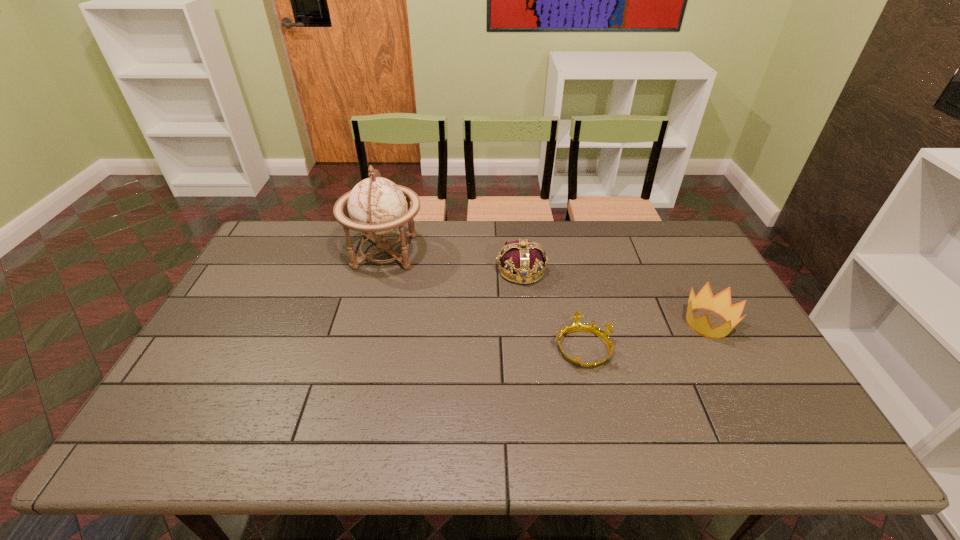
The width and height of the screenshot is (960, 540). I want to click on globe, so click(x=377, y=206).

Locate an element on the screen. The image size is (960, 540). the tallest object is located at coordinates (377, 206).

The image size is (960, 540). Find the location of `the second tallest object`. the second tallest object is located at coordinates (524, 259).

The height and width of the screenshot is (540, 960). I want to click on the tallest crown, so click(524, 259).

At what (x,y) coordinates should I click in order to perform the action: click on the rightmost object. Please return your answer as a coordinate pair (x, y). Looking at the image, I should click on (721, 303).

Image resolution: width=960 pixels, height=540 pixels. I want to click on the second tallest crown, so click(x=721, y=303).

The height and width of the screenshot is (540, 960). Find the location of `the shortest object`. the shortest object is located at coordinates (576, 326).

Locate an element on the screen. vacant space positioned at the front of the tallest object showing Africa is located at coordinates (507, 252).

What are the coordinates of `vacant space located 0.370m on the right of the tallest crown` in the screenshot? It's located at (661, 271).

You are a GUI agent. You are given a task and a screenshot of the screen. Output one action in this format:
    pyautogui.click(x=<x>, y=<y>)
    Task: Click on the vacant space situated on the back of the rightmost crown
    
    Given the screenshot: What is the action you would take?
    pyautogui.click(x=672, y=255)